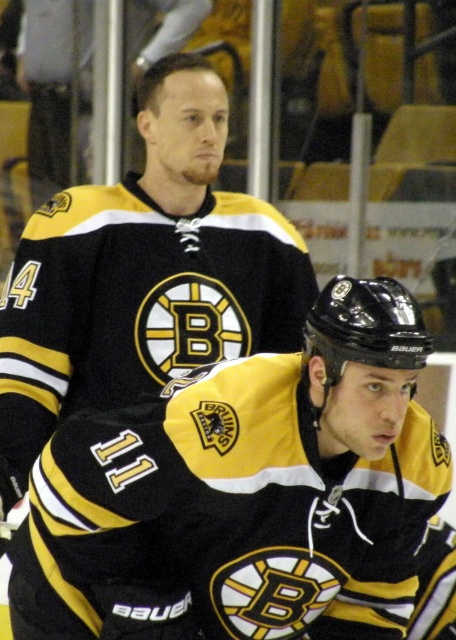
You are a sports equipment manager checking the sizes of the jerseys in the image. Which jersey has a smaller width, the black matte jersey at center or the black matte jersey at upper center?

The black matte jersey at center has a smaller width than the black matte jersey at upper center.

You are a photographer at the hockey rink and want to take a photo of both the black matte jersey at center and the black matte jersey at upper center. Which jersey should you focus on first if you want to capture them from left to right order?

The black matte jersey at upper center should be focused on first since it is positioned to the left of the black matte jersey at center.